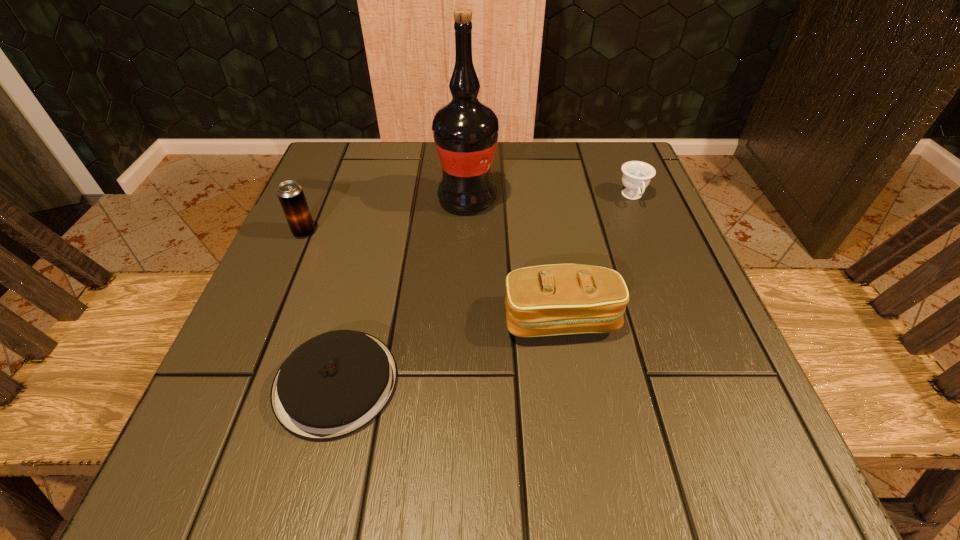
Find the location of a particular element. The image size is (960, 540). free space located on the left of the tallest object is located at coordinates (333, 199).

Locate an element on the screen. free space located 0.270m on the back of the beer can is located at coordinates (338, 153).

I want to click on vacant space located 0.100m on the zipper side of the clutch bag, so click(x=575, y=408).

Where is `vacant space located 0.180m on the side of the second shortest object with the handle`? The image size is (960, 540). vacant space located 0.180m on the side of the second shortest object with the handle is located at coordinates (663, 273).

Find the location of `vacant region located on the back of the second object from left to right`. vacant region located on the back of the second object from left to right is located at coordinates (368, 258).

Identify the location of wine bottle that is at the far edge. This screenshot has height=540, width=960. (465, 131).

This screenshot has width=960, height=540. Find the location of `teacup present at the far edge`. teacup present at the far edge is located at coordinates (636, 176).

Identify the location of object located in the near edge section of the desktop. The height and width of the screenshot is (540, 960). (332, 385).

Locate an element on the screen. This screenshot has height=540, width=960. beer can located in the left edge section of the desktop is located at coordinates (290, 194).

Find the location of `pancake situated at the left edge`. pancake situated at the left edge is located at coordinates (332, 385).